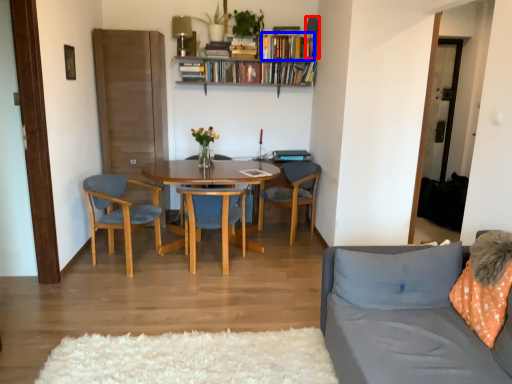
Question: Which object is closer to the camera taking this photo, lamp (highlighted by a red box) or book (highlighted by a blue box)?

Choices:
 (A) lamp
 (B) book

Answer: (A)